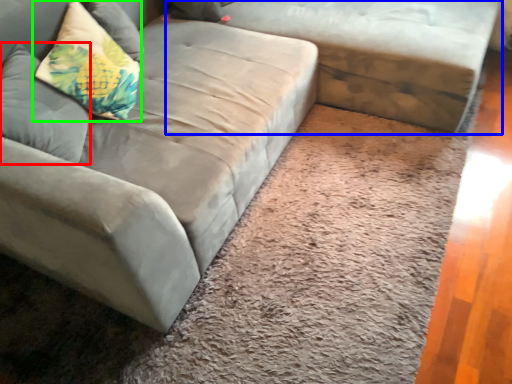
Question: Based on their relative distances, which object is farther from pillow (highlighted by a red box)? Choose from studio couch (highlighted by a blue box) and pillow (highlighted by a green box).

Choices:
 (A) studio couch
 (B) pillow

Answer: (A)